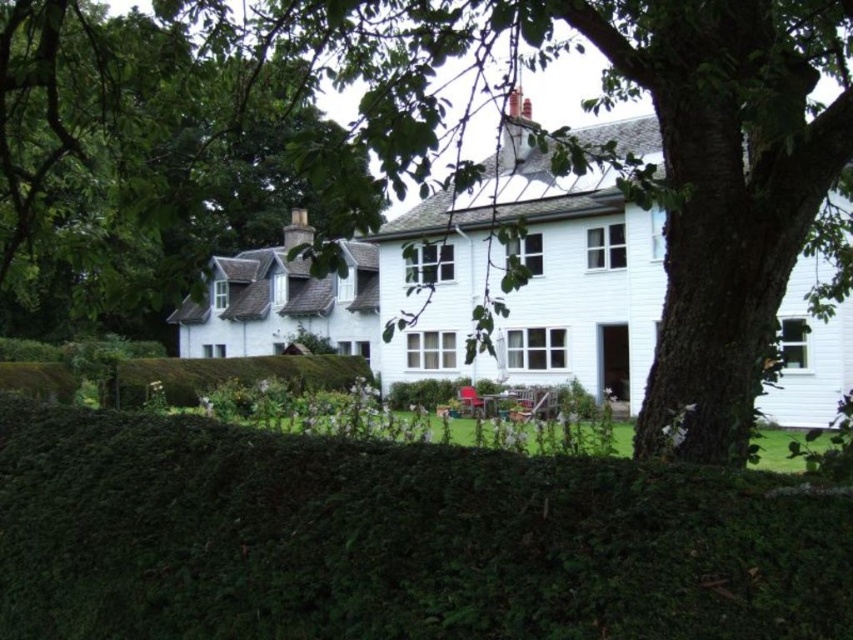
Question: From the image, what is the correct spatial relationship of green leafy hedge at lower center in relation to green leafy tree at upper left?

Choices:
 (A) below
 (B) above

Answer: (A)

Question: Estimate the real-world distances between objects in this image. Which object is farther from the green leafy tree at upper left?

Choices:
 (A) green leafy tree at center
 (B) green leafy hedge at lower center

Answer: (B)

Question: Does green leafy hedge at lower center appear over green leafy tree at center?

Choices:
 (A) no
 (B) yes

Answer: (A)

Question: Considering the relative positions of green leafy hedge at lower center and green leafy tree at upper left in the image provided, where is green leafy hedge at lower center located with respect to green leafy tree at upper left?

Choices:
 (A) left
 (B) right

Answer: (B)

Question: Among these points, which one is nearest to the camera?

Choices:
 (A) (263, 122)
 (B) (814, 147)

Answer: (B)

Question: Which of these objects is positioned closest to the green leafy tree at upper left?

Choices:
 (A) green leafy hedge at lower center
 (B) green leafy tree at center

Answer: (B)